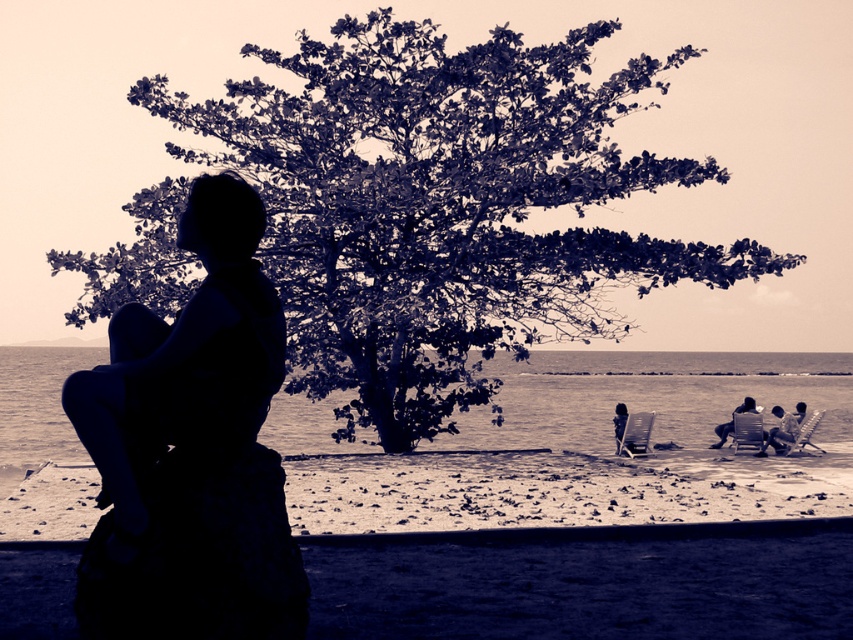
Is sepia water at lower center to the right of dark blue fabric chair at lower right from the viewer's perspective?

Indeed, sepia water at lower center is positioned on the right side of dark blue fabric chair at lower right.

Does sepia water at lower center lie in front of dark blue fabric chair at lower right?

Yes, it is in front of dark blue fabric chair at lower right.

Locate an element on the screen. The width and height of the screenshot is (853, 640). sepia water at lower center is located at coordinates (598, 451).

Image resolution: width=853 pixels, height=640 pixels. I want to click on sepia water at lower center, so click(x=598, y=451).

Which is below, sepia water at lower center or smooth fabric chair at lower right?

Positioned lower is sepia water at lower center.

Where is `sepia water at lower center`? sepia water at lower center is located at coordinates (598, 451).

Is green leafy tree at center taller than dark blue fabric chair at lower right?

Correct, green leafy tree at center is much taller as dark blue fabric chair at lower right.

Is green leafy tree at center thinner than dark blue fabric chair at lower right?

No, green leafy tree at center is not thinner than dark blue fabric chair at lower right.

Is point (421, 285) positioned in front of point (624, 412)?

Yes, point (421, 285) is in front of point (624, 412).

At what (x,y) coordinates should I click in order to perform the action: click on green leafy tree at center. Please return your answer as a coordinate pair (x, y). Looking at the image, I should click on (440, 205).